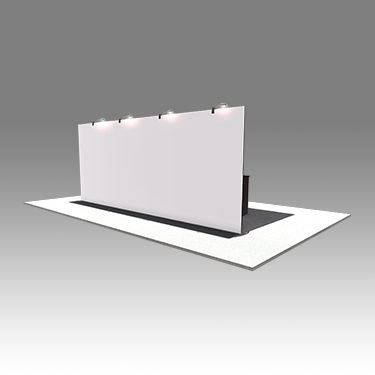
This screenshot has height=375, width=375. What are the coordinates of `lights` in the screenshot? It's located at (219, 103), (166, 111), (133, 115), (102, 117).